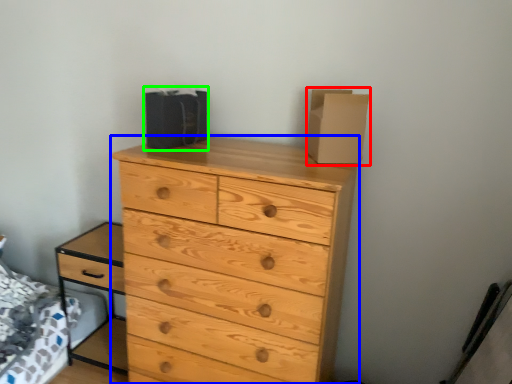
Question: Based on their relative distances, which object is farther from cardboard box (highlighted by a red box)? Choose from chest of drawers (highlighted by a blue box) and cardboard box (highlighted by a green box).

Choices:
 (A) chest of drawers
 (B) cardboard box

Answer: (B)